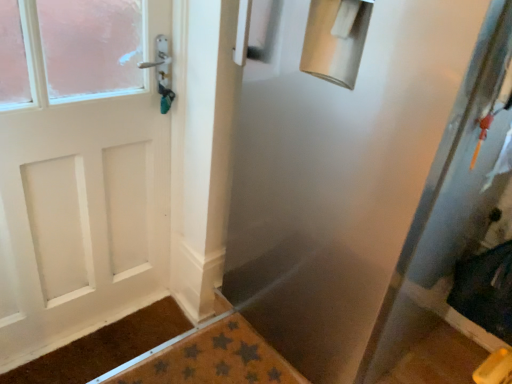
Image resolution: width=512 pixels, height=384 pixels. What are the coordinates of `free space above brown textured bath mat at lower center (from a real-world perspective)` in the screenshot? It's located at (201, 361).